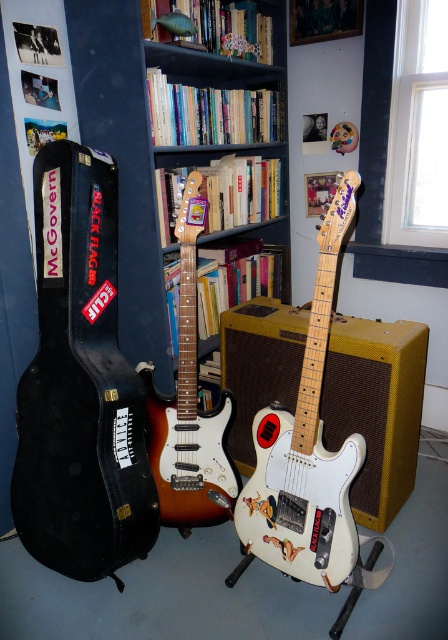
You are a delivery person who needs to place a new 30 inch wide package between the wooden bookcase at center and the white glossy electric guitar at center. Can you fit the package in the space between them?

The wooden bookcase at center and white glossy electric guitar at center are 29.59 inches apart from each other. Since the package is 30 inches wide, it is slightly wider than the available space, so it won

You are a music teacher who wants to display two electric guitars in a small classroom. The white glossy electric guitar at center and the sunburst wood electric guitar at center are available. Which guitar should you choose if you want to use the one that takes up more space?

The white glossy electric guitar at center has a larger size compared to the sunburst wood electric guitar at center, so it would take up more space and is the better choice for your display.